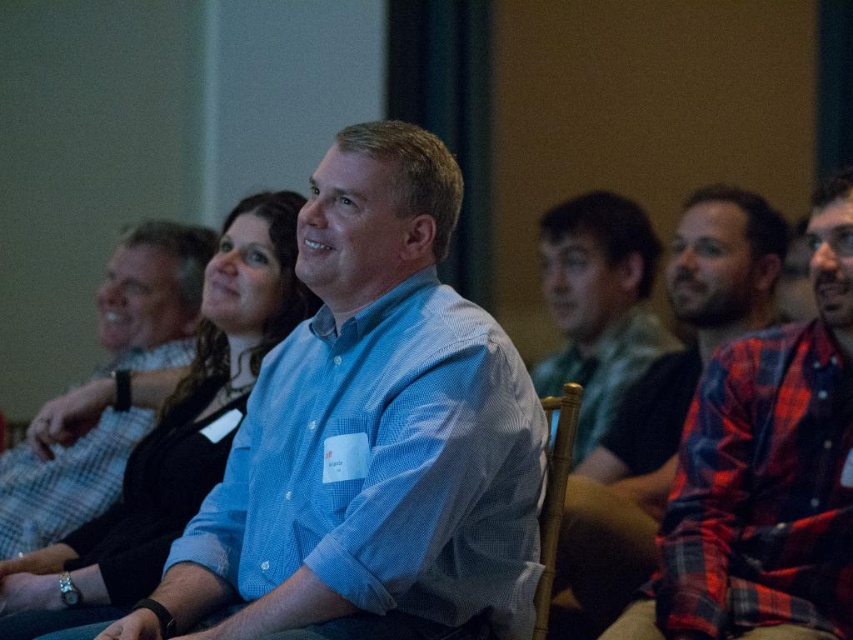
What do you see at coordinates (766, 474) in the screenshot?
I see `red plaid shirt at right` at bounding box center [766, 474].

Between point (693, 540) and point (631, 269), which one is positioned behind?

The point (631, 269) is behind.

This screenshot has width=853, height=640. I want to click on red plaid shirt at right, so click(x=766, y=474).

Who is taller, blue checkered shirt at center or wooden at center?

blue checkered shirt at center

Measure the distance between point [221,522] and camera.

1.68 meters

The image size is (853, 640). Find the location of `blue checkered shirt at center`. blue checkered shirt at center is located at coordinates click(x=370, y=438).

Can you confirm if red plaid shirt at right is positioned above wooden at center?

Indeed, red plaid shirt at right is positioned over wooden at center.

Does red plaid shirt at right have a lesser height compared to wooden at center?

No.

The image size is (853, 640). In order to click on red plaid shirt at right in this screenshot , I will do `click(766, 474)`.

This screenshot has width=853, height=640. Find the location of `red plaid shirt at right`. red plaid shirt at right is located at coordinates (766, 474).